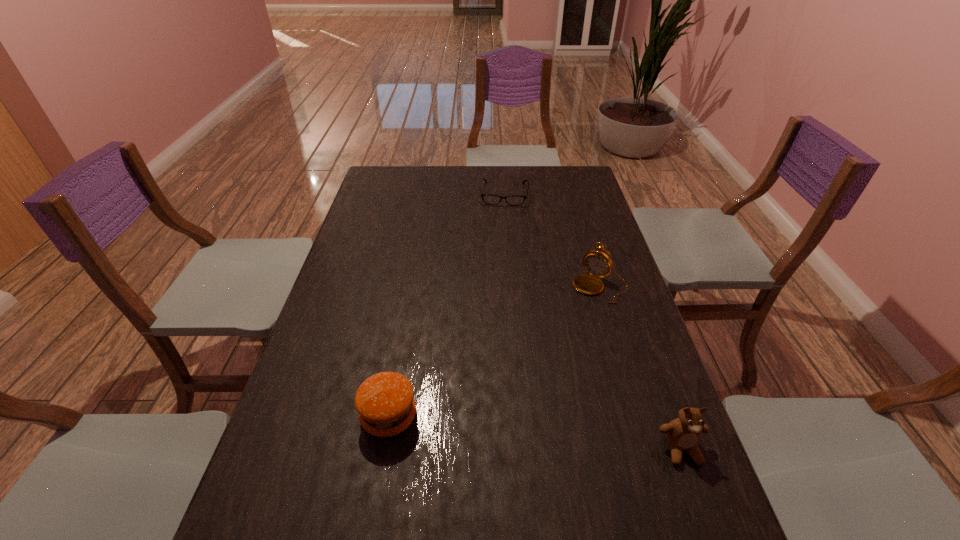
The height and width of the screenshot is (540, 960). Identify the location of vacant point located between the pocket watch and the third tallest object. (494, 352).

Locate an element on the screen. Image resolution: width=960 pixels, height=540 pixels. blank region between the patty and the teddy bear is located at coordinates (536, 433).

This screenshot has width=960, height=540. I want to click on object that stands as the third closest to the patty, so click(515, 200).

This screenshot has width=960, height=540. I want to click on object that stands as the third closest to the spectacles, so click(683, 434).

I want to click on vacant area that satisfies the following two spatial constraints: 1. on the back side of the second shortest object; 2. on the left side of the shortest object, so click(428, 194).